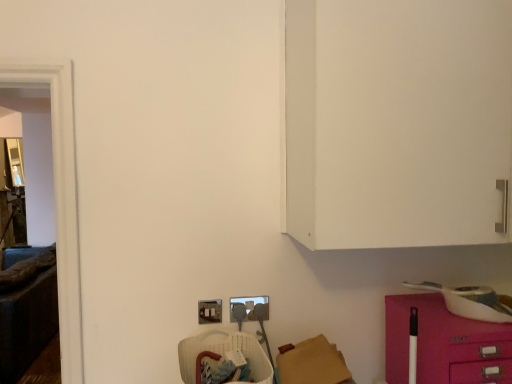
Question: Could you tell me if metallic silver electric outlet at lower center, which is the 2th electric outlet from right to left, is facing pink glossy drawer at lower right?

Choices:
 (A) yes
 (B) no

Answer: (B)

Question: From a real-world perspective, is metallic silver electric outlet at lower center, arranged as the 1th electric outlet when viewed from the left, positioned over pink glossy drawer at lower right based on gravity?

Choices:
 (A) yes
 (B) no

Answer: (A)

Question: Considering the relative sizes of metallic silver electric outlet at lower center, which is the 2th electric outlet from right to left, and pink glossy drawer at lower right in the image provided, is metallic silver electric outlet at lower center, which is the 2th electric outlet from right to left, taller than pink glossy drawer at lower right?

Choices:
 (A) no
 (B) yes

Answer: (A)

Question: From the image's perspective, does metallic silver electric outlet at lower center, which is the 2th electric outlet from right to left, appear higher than pink glossy drawer at lower right?

Choices:
 (A) yes
 (B) no

Answer: (A)

Question: Is the depth of metallic silver electric outlet at lower center, which is the 2th electric outlet from right to left, greater than that of pink glossy drawer at lower right?

Choices:
 (A) no
 (B) yes

Answer: (B)

Question: In the image, is pink glossy drawer at lower right on the left side or the right side of transparent glass door at left?

Choices:
 (A) right
 (B) left

Answer: (A)

Question: Is pink glossy drawer at lower right situated inside transparent glass door at left or outside?

Choices:
 (A) inside
 (B) outside

Answer: (B)

Question: In terms of size, does pink glossy drawer at lower right appear bigger or smaller than transparent glass door at left?

Choices:
 (A) small
 (B) big

Answer: (B)

Question: From the image's perspective, relative to transparent glass door at left, is pink glossy drawer at lower right above or below?

Choices:
 (A) below
 (B) above

Answer: (A)

Question: In terms of height, does transparent glass door at left look taller or shorter compared to matte gray plug at lower center, which is the second electric outlet in left-to-right order?

Choices:
 (A) tall
 (B) short

Answer: (A)

Question: From the image's perspective, relative to matte gray plug at lower center, which is the second electric outlet in left-to-right order, is transparent glass door at left above or below?

Choices:
 (A) below
 (B) above

Answer: (B)

Question: Looking at the image, does transparent glass door at left seem bigger or smaller compared to matte gray plug at lower center, which is the second electric outlet in left-to-right order?

Choices:
 (A) small
 (B) big

Answer: (B)

Question: In the image, is transparent glass door at left on the left side or the right side of matte gray plug at lower center, positioned as the first electric outlet in right-to-left order?

Choices:
 (A) left
 (B) right

Answer: (A)

Question: Considering the positions of translucent plastic basket at lower center and pink glossy drawer at lower right in the image, is translucent plastic basket at lower center bigger or smaller than pink glossy drawer at lower right?

Choices:
 (A) big
 (B) small

Answer: (B)

Question: From the image's perspective, relative to pink glossy drawer at lower right, is translucent plastic basket at lower center above or below?

Choices:
 (A) above
 (B) below

Answer: (B)